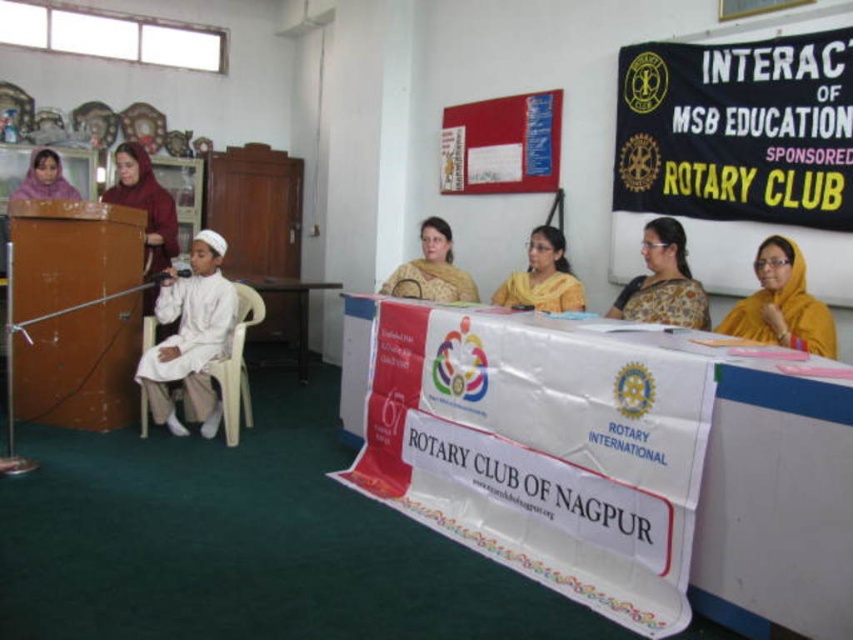
You are an attendee at the event and want to describe the speaker setup. Which fabric is positioned to the right of the other between the yellow fabric at center and the golden fabric saree at center?

The yellow fabric at center is positioned to the right of the golden fabric saree at center.

You are a photographer at the event and need to ensure both the white cotton robe at center and the satin yellow sari at center are visible in the photo. Considering their heights, which one should you focus on to capture both effectively?

The white cotton robe at center is taller than the satin yellow sari at center, so focusing on the white cotton robe at center will ensure both are visible in the photo.